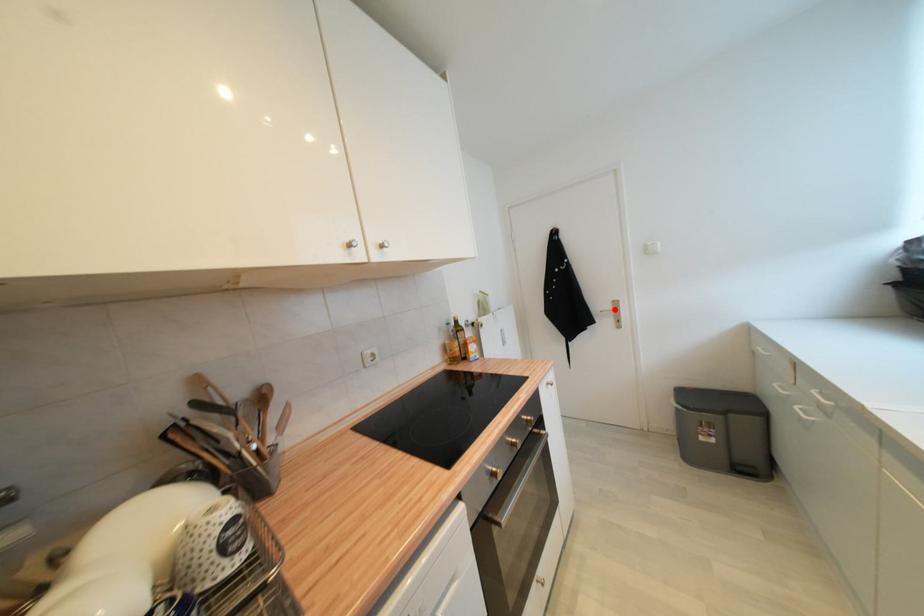
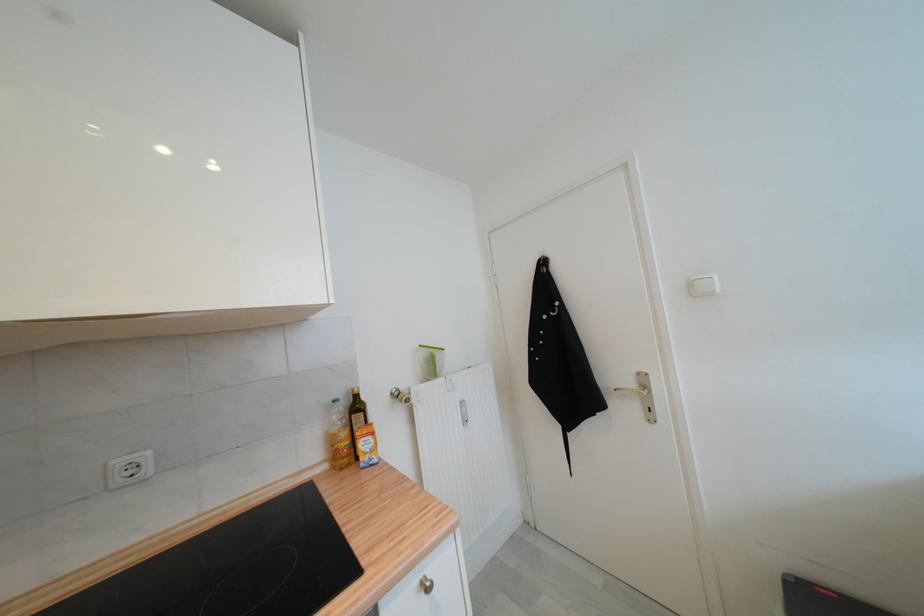
Find the pixel in the second image that matches the highlighted location in the first image.

(637, 386)